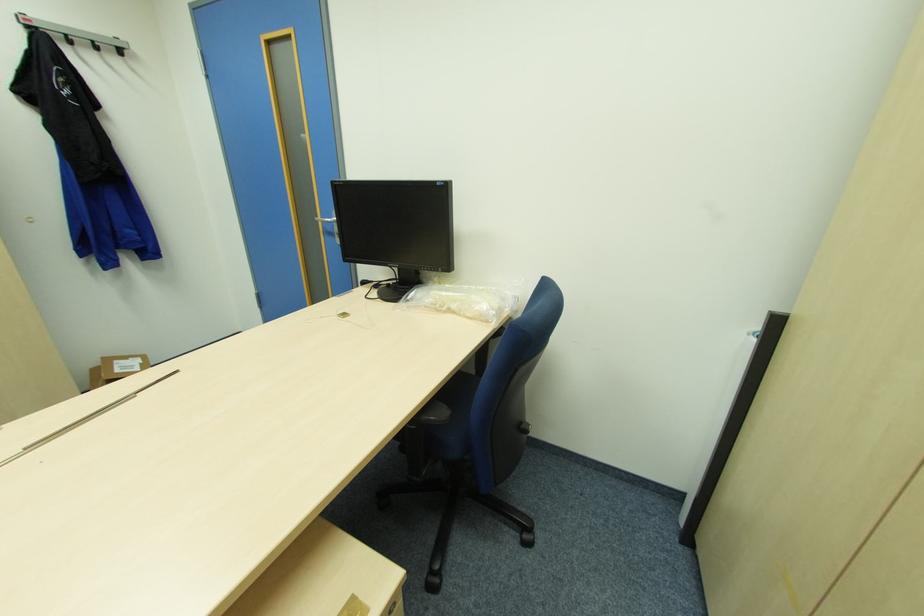
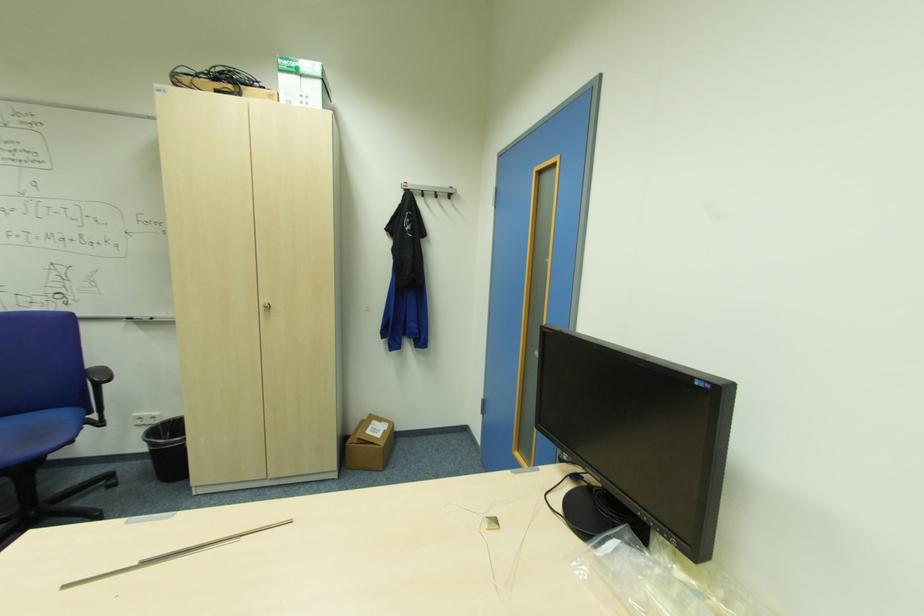
Question: The first image is from the beginning of the video and the second image is from the end. How did the camera likely rotate when shooting the video?

Choices:
 (A) Left
 (B) Right
 (C) Up
 (D) Down

Answer: (A)